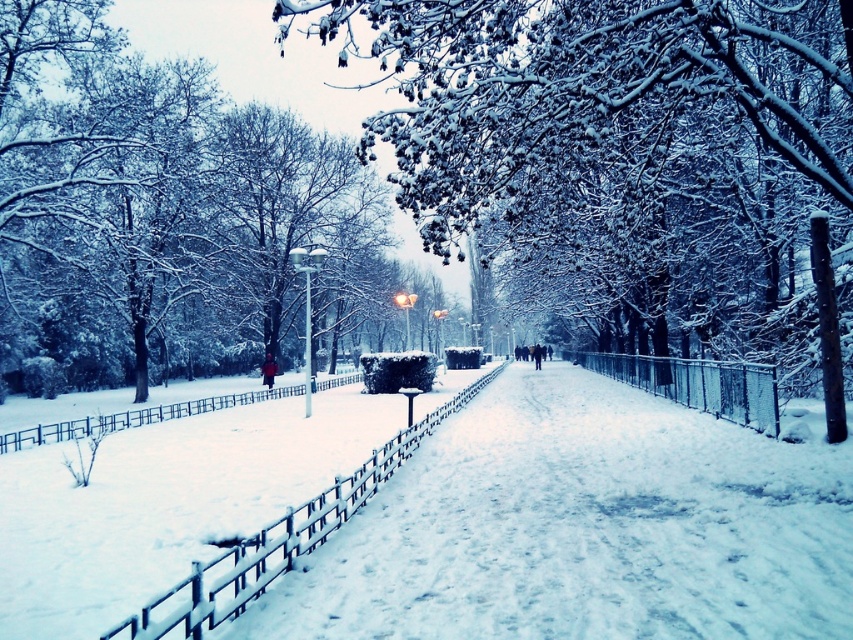
Can you confirm if white wooden fence at center is positioned to the right of white plastic fence at lower left?

Yes, white wooden fence at center is to the right of white plastic fence at lower left.

Can you confirm if white wooden fence at center is thinner than white plastic fence at lower left?

Yes, white wooden fence at center is thinner than white plastic fence at lower left.

Is point (230, 588) positioned after point (32, 429)?

That is False.

You are a GUI agent. You are given a task and a screenshot of the screen. Output one action in this format:
    pyautogui.click(x=<x>, y=<y>)
    Task: Click on the white wooden fence at center
    
    Given the screenshot: What is the action you would take?
    pyautogui.click(x=277, y=541)

Looking at this image, does snow-covered branches at center appear on the right side of white wooden fence at center?

Indeed, snow-covered branches at center is positioned on the right side of white wooden fence at center.

Is snow-covered branches at center to the left of white wooden fence at center from the viewer's perspective?

Incorrect, snow-covered branches at center is not on the left side of white wooden fence at center.

Describe the element at coordinates (549, 84) in the screenshot. I see `snow-covered branches at center` at that location.

Where is `snow-covered branches at center`? The height and width of the screenshot is (640, 853). snow-covered branches at center is located at coordinates (549, 84).

How much distance is there between snow-covered branches at center and metallic silver fence at center-right?

A distance of 8.43 meters exists between snow-covered branches at center and metallic silver fence at center-right.

Does snow-covered branches at center appear over metallic silver fence at center-right?

Yes, snow-covered branches at center is above metallic silver fence at center-right.

The image size is (853, 640). In order to click on snow-covered branches at center in this screenshot , I will do `click(549, 84)`.